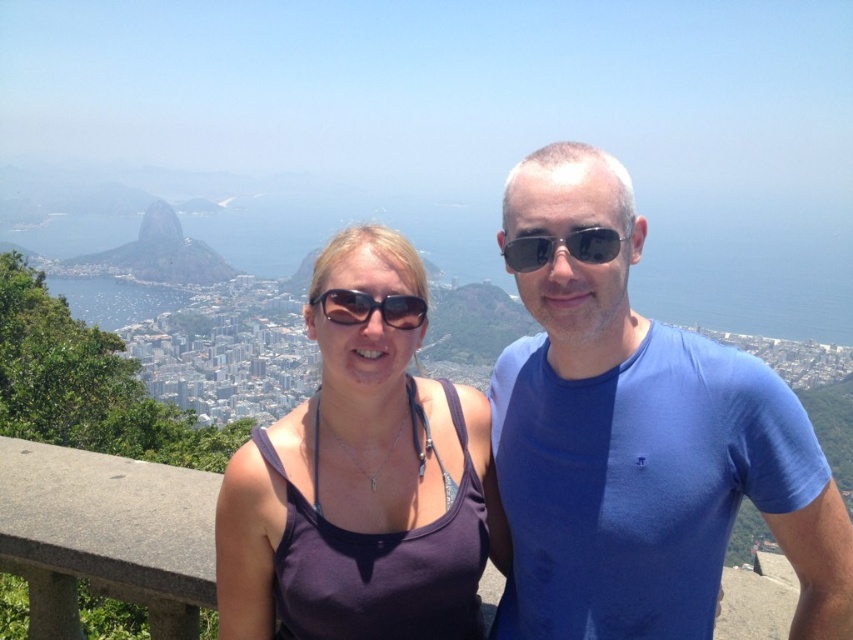
Consider the image. Can you confirm if purple fabric tank top at center is positioned to the right of green grassy hill at upper left?

Yes, purple fabric tank top at center is to the right of green grassy hill at upper left.

Who is higher up, purple fabric tank top at center or green grassy hill at upper left?

green grassy hill at upper left is higher up.

Between point (408, 556) and point (206, 252), which one is positioned in front?

Point (408, 556) is more forward.

Locate an element on the screen. purple fabric tank top at center is located at coordinates coord(360,502).

Does blue cotton t-shirt at center come in front of matte black sunglasses at center?

Yes, blue cotton t-shirt at center is in front of matte black sunglasses at center.

Measure the distance between blue cotton t-shirt at center and camera.

blue cotton t-shirt at center and camera are 605.31 meters apart from each other.

Locate an element on the screen. Image resolution: width=853 pixels, height=640 pixels. blue cotton t-shirt at center is located at coordinates (639, 442).

Between blue cotton t-shirt at center and purple fabric tank top at center, which one appears on the right side from the viewer's perspective?

blue cotton t-shirt at center is more to the right.

The height and width of the screenshot is (640, 853). What do you see at coordinates (639, 442) in the screenshot? I see `blue cotton t-shirt at center` at bounding box center [639, 442].

Who is more distant from viewer, (650, 387) or (231, 522)?

The point (650, 387) is more distant.

Where is `blue cotton t-shirt at center`? blue cotton t-shirt at center is located at coordinates (639, 442).